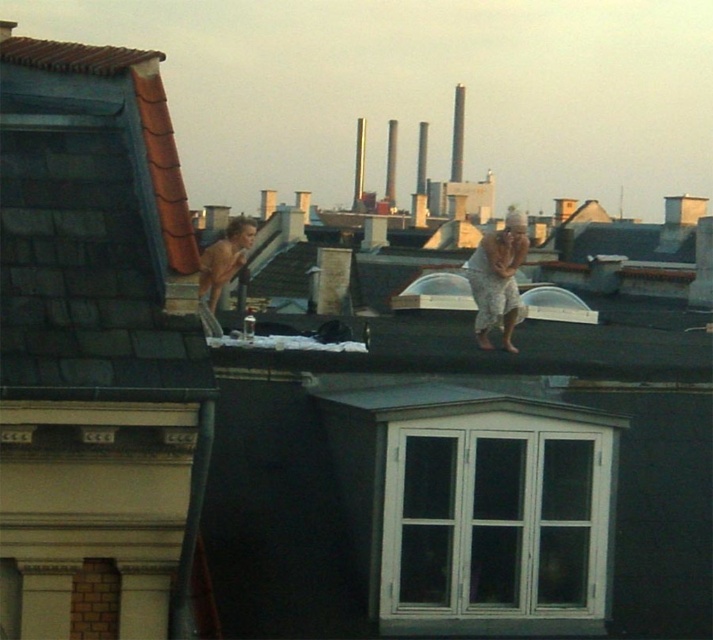
You are a photographer trying to capture the scene on the rooftop. You notice two subjects wearing gray textured pants at center and shiny skin at center. Which subject should you focus on if you want to capture the larger subject in your shot?

The shiny skin at center is larger because it occupies more space than the gray textured pants at center.

You are a photographer trying to capture the scene from the ground. Based on the image, which object is positioned lower in the frame between the gray textured pants at center and the shiny skin at center?

The gray textured pants at center is positioned below the shiny skin at center, so the gray textured pants at center is lower in the frame.